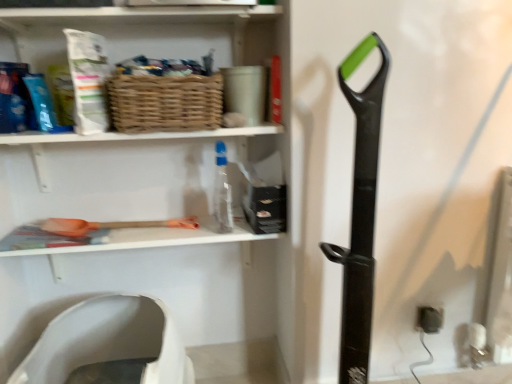
Question: Is woven brown basket at upper center looking in the opposite direction of white matte shelf at upper center, the 2th shelf when ordered from top to bottom?

Choices:
 (A) no
 (B) yes

Answer: (A)

Question: Is woven brown basket at upper center positioned in front of white matte shelf at upper center, which appears as the 1th shelf when ordered from the bottom?

Choices:
 (A) yes
 (B) no

Answer: (A)

Question: Does woven brown basket at upper center have a larger size compared to white matte shelf at upper center, which appears as the 1th shelf when ordered from the bottom?

Choices:
 (A) yes
 (B) no

Answer: (B)

Question: Is woven brown basket at upper center further to the viewer compared to white matte shelf at upper center, the 2th shelf when ordered from top to bottom?

Choices:
 (A) yes
 (B) no

Answer: (B)

Question: Is woven brown basket at upper center taller than white matte shelf at upper center, which appears as the 1th shelf when ordered from the bottom?

Choices:
 (A) yes
 (B) no

Answer: (B)

Question: In terms of height, does white matte shelf at upper center, the 2th shelf when ordered from top to bottom, look taller or shorter compared to transparent plastic bottle at center?

Choices:
 (A) short
 (B) tall

Answer: (A)

Question: Is white matte shelf at upper center, which appears as the 1th shelf when ordered from the bottom, inside the boundaries of transparent plastic bottle at center, or outside?

Choices:
 (A) inside
 (B) outside

Answer: (B)

Question: In the image, is white matte shelf at upper center, which appears as the 1th shelf when ordered from the bottom, positioned in front of or behind transparent plastic bottle at center?

Choices:
 (A) behind
 (B) front

Answer: (B)

Question: Is point (184, 208) closer or farther from the camera than point (222, 193)?

Choices:
 (A) closer
 (B) farther

Answer: (B)

Question: In the image, is white plastic toilet seat at lower left positioned in front of or behind matte wicker basket at upper center, which ranks as the second shelf in bottom-to-top order?

Choices:
 (A) front
 (B) behind

Answer: (A)

Question: Does point (132, 345) appear closer or farther from the camera than point (264, 16)?

Choices:
 (A) closer
 (B) farther

Answer: (B)

Question: From a real-world perspective, is white plastic toilet seat at lower left positioned above or below matte wicker basket at upper center, arranged as the 1th shelf when viewed from the top?

Choices:
 (A) below
 (B) above

Answer: (A)

Question: Looking at the image, does white plastic toilet seat at lower left seem bigger or smaller compared to matte wicker basket at upper center, which ranks as the second shelf in bottom-to-top order?

Choices:
 (A) big
 (B) small

Answer: (A)

Question: Considering the positions of transparent plastic bottle at center and white plastic toilet seat at lower left in the image, is transparent plastic bottle at center wider or thinner than white plastic toilet seat at lower left?

Choices:
 (A) thin
 (B) wide

Answer: (A)

Question: From the image's perspective, relative to white plastic toilet seat at lower left, is transparent plastic bottle at center above or below?

Choices:
 (A) below
 (B) above

Answer: (B)